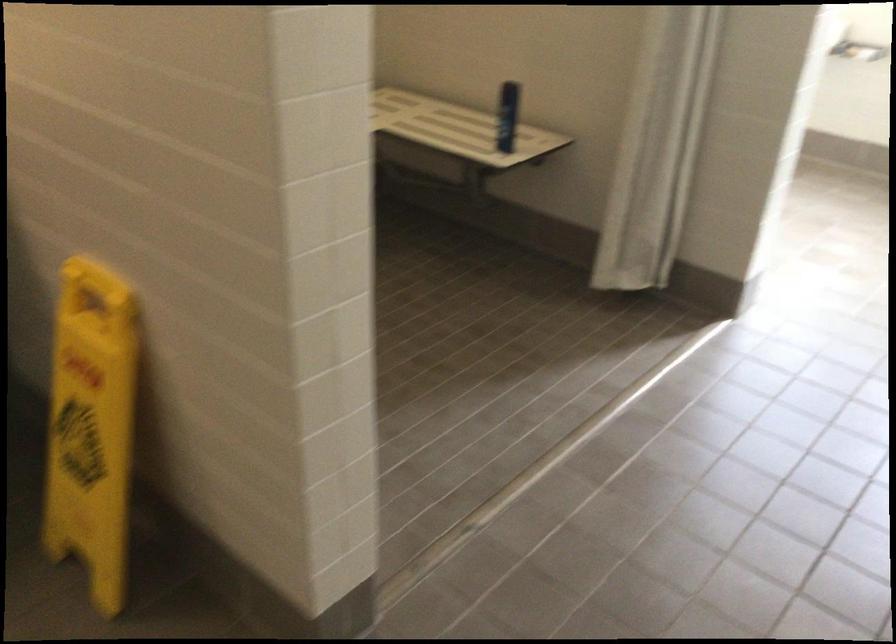
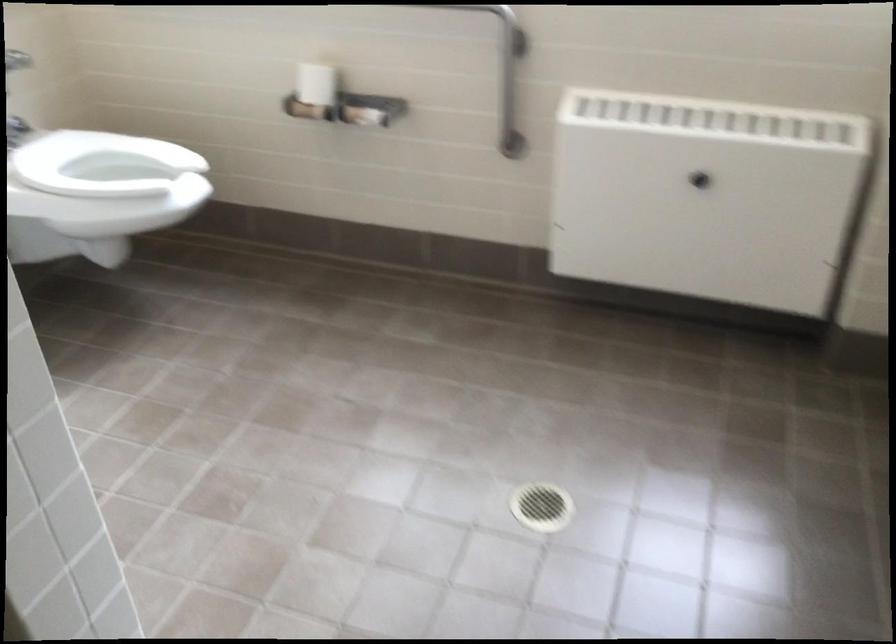
What movement of the cameraman would produce the second image?

The cameraman walked toward right, forward.